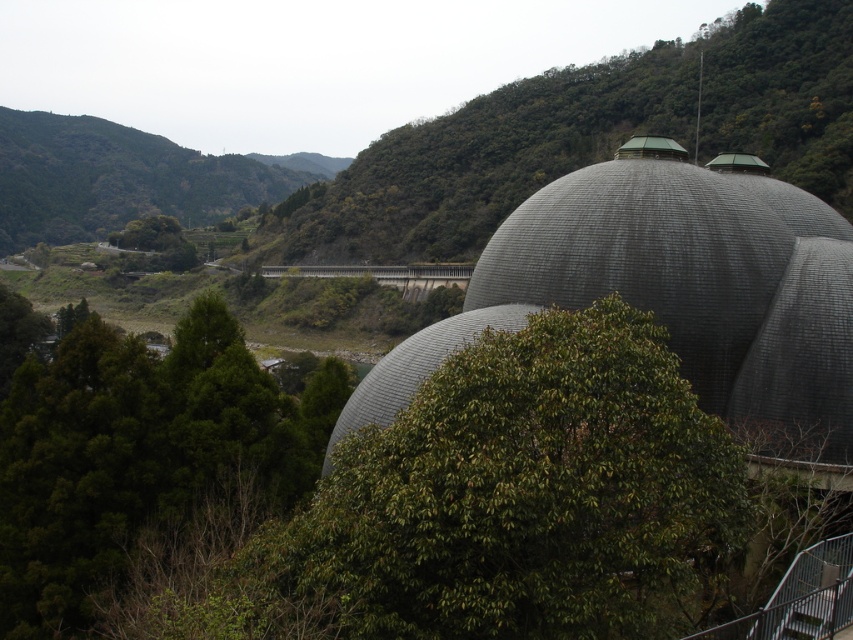
You are standing at the starting point and want to reach the gray textured dome at center. If your walking speed is 3 feet per second, how many seconds will it take you to reach the dome?

The distance between you and the gray textured dome at center is 69.89 feet. At a speed of 3 feet per second, the time required is 69.89 divided by 3, which equals approximately 23.3 seconds.

You are a hiker trying to navigate through the landscape. You notice two trees, the green leafy tree at center and the green leafy tree at lower left. Which tree would you need to look up higher to see the top of?

The green leafy tree at center is taller than the green leafy tree at lower left, so you would need to look up higher to see the top of the green leafy tree at center.